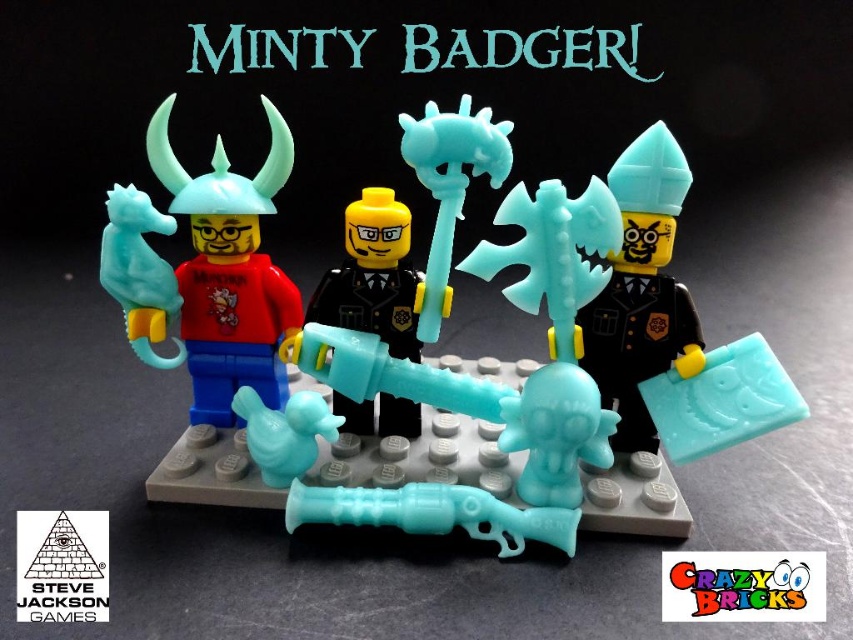
The width and height of the screenshot is (853, 640). Describe the element at coordinates (206, 273) in the screenshot. I see `matte plastic minifigure at left` at that location.

Is matte plastic minifigure at left thinner than translucent blue plastic axe at center?

No.

Is point (209, 214) behind point (378, 227)?

That is True.

The height and width of the screenshot is (640, 853). Identify the location of matte plastic minifigure at left. (206, 273).

Does matte plastic axe at center have a lesser width compared to matte plastic minifigure at left?

Incorrect, matte plastic axe at center's width is not less than matte plastic minifigure at left's.

Can you confirm if matte plastic axe at center is smaller than matte plastic minifigure at left?

Actually, matte plastic axe at center might be larger than matte plastic minifigure at left.

Is point (718, 397) behind point (264, 337)?

No, it is not.

I want to click on matte plastic axe at center, so click(474, 401).

Does matte plastic axe at center appear over translucent blue plastic axe at center?

Yes, matte plastic axe at center is above translucent blue plastic axe at center.

Who is lower down, matte plastic axe at center or translucent blue plastic axe at center?

translucent blue plastic axe at center

Is point (514, 512) behind point (392, 324)?

No, it is not.

Find the location of a particular element. This screenshot has height=640, width=853. matte plastic axe at center is located at coordinates (474, 401).